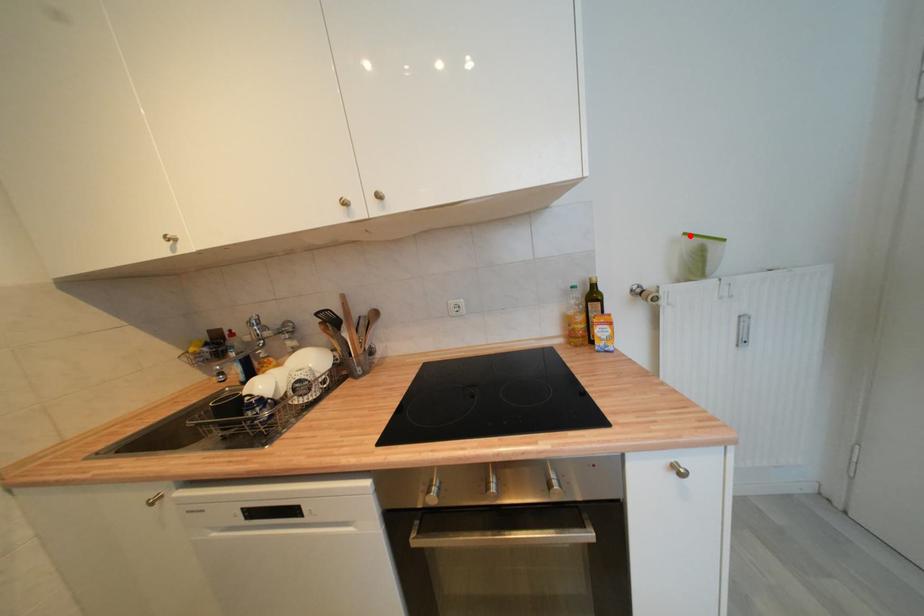
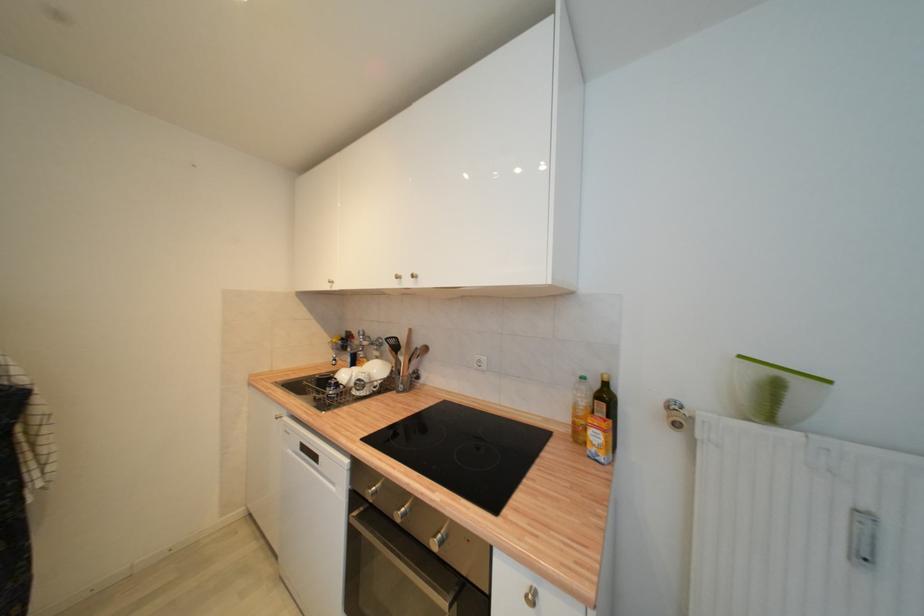
Find the pixel in the second image that matches the highlighted location in the first image.

(746, 359)